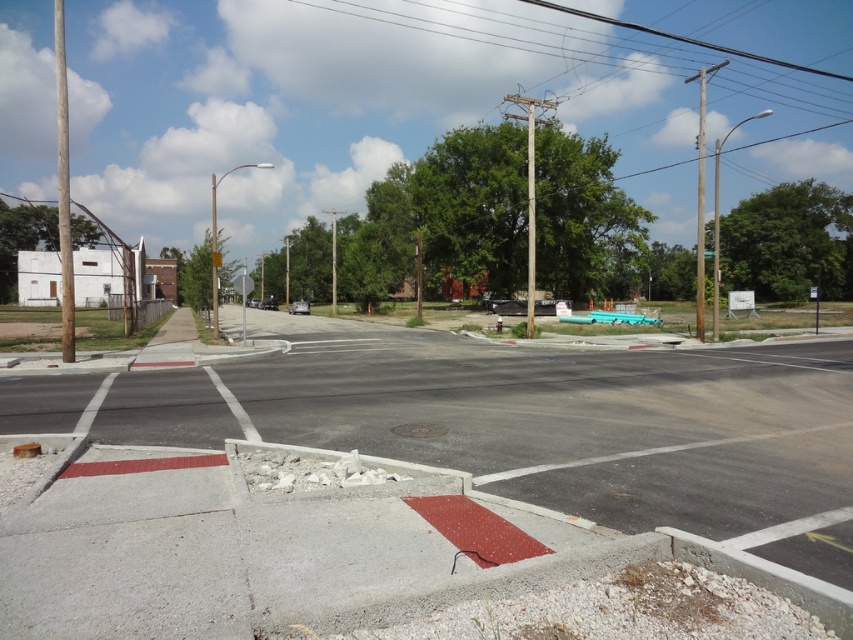
You are standing at the center of the intersection. Which direction should you walk to reach the wooden pole at left?

You should walk towards the left direction to reach the wooden pole at left.

You are a city planner evaluating the street layout. You notice the smooth wood pole at upper right and the smooth gray pole at center. Which pole has a larger diameter?

The smooth wood pole at upper right has a larger diameter than the smooth gray pole at center.